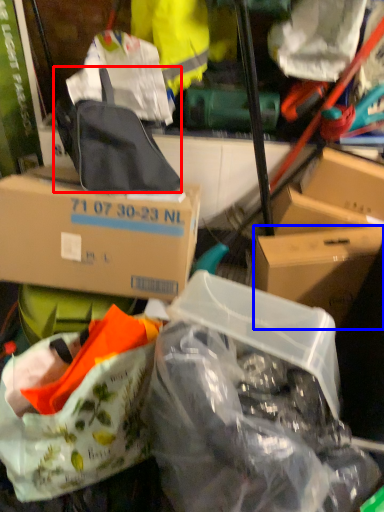
Question: Which object appears farthest to the camera in this image, backpack (highlighted by a red box) or box (highlighted by a blue box)?

Choices:
 (A) backpack
 (B) box

Answer: (B)